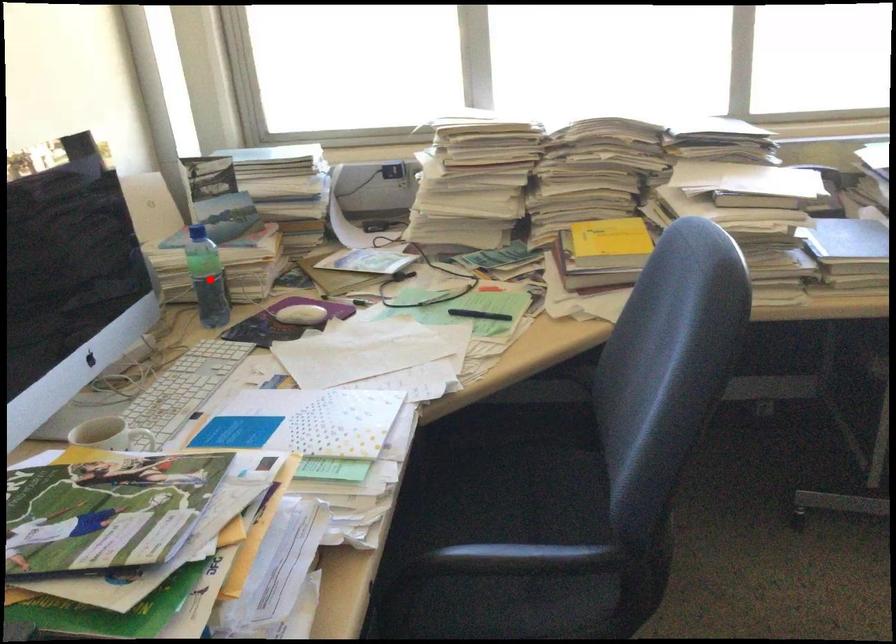
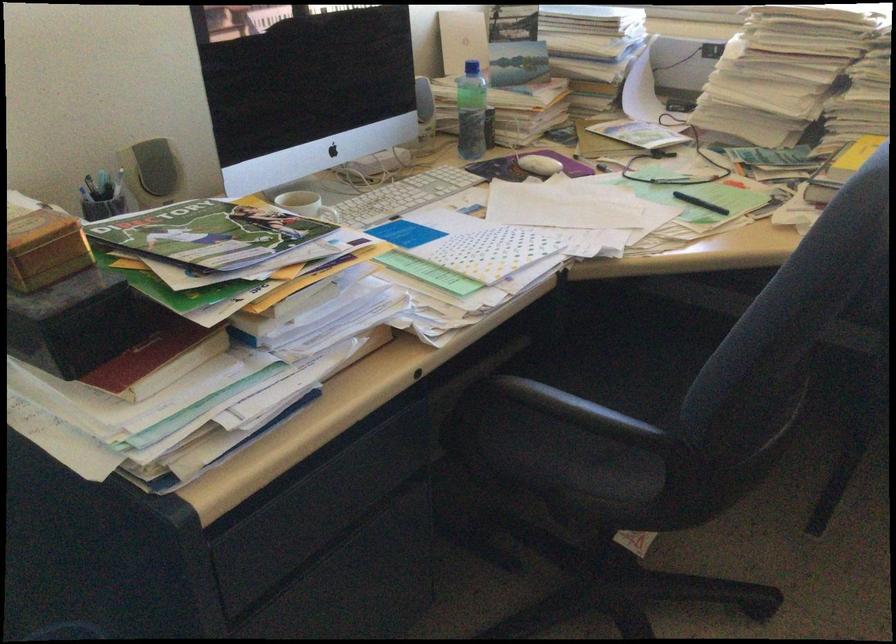
Where in the second image is the point corresponding to the highlighted location from the first image?

(470, 111)